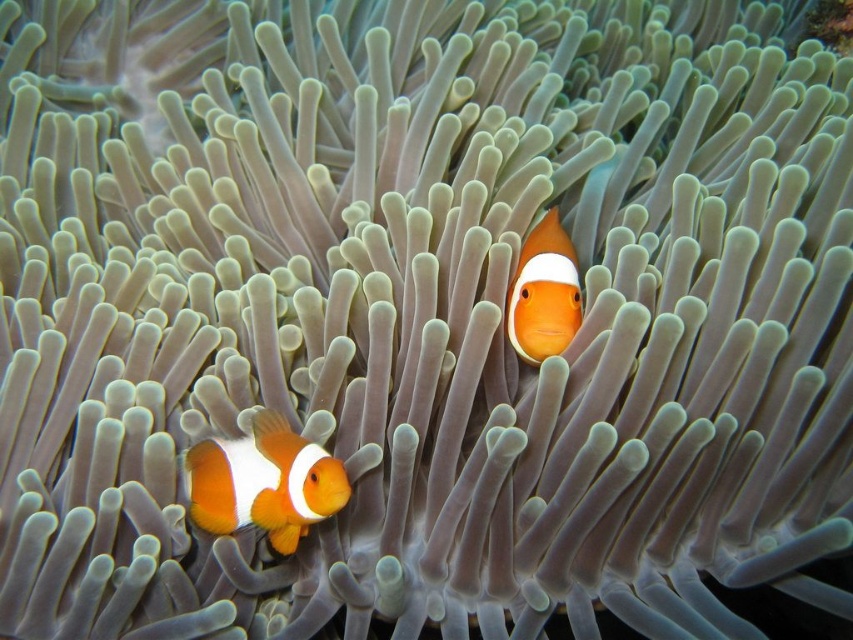
You are a marine biologist observing the clownfish in the image. You notice two points marked in the scene. Which point is closer to you, point [216,451] or point [566,276]?

Point [216,451] is in front of point [566,276], so it is closer to you.

You are a marine biologist observing the orange matte clownfish at lower left through a waterproof camera. The camera has a focal length of 50mm and an aperture of f2.8. If you want to ensure the clownfish remains in focus while adjusting the camera settings, what distance should you set the focus to?

The orange matte clownfish at lower left and camera are 1.41 meters apart from each other, so you should set the focus distance to 1.41 meters to keep the clownfish in focus.